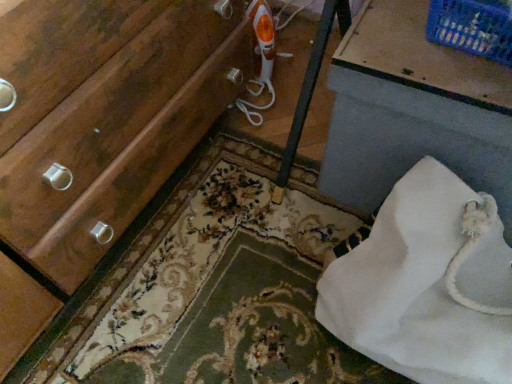
Where is `free space that is to the left of blue plastic basket at upper right`? free space that is to the left of blue plastic basket at upper right is located at coordinates (385, 33).